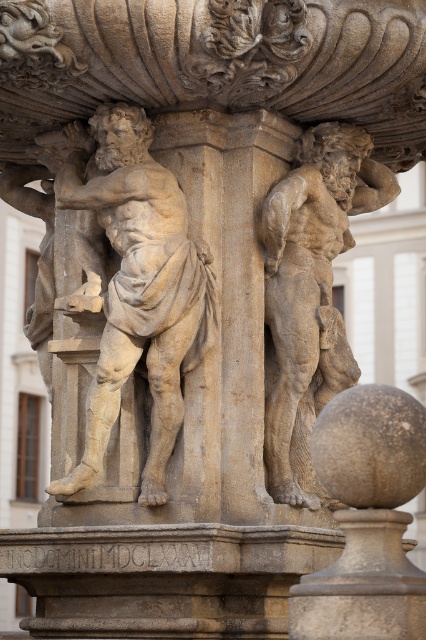
Question: Which point appears closest to the camera in this image?

Choices:
 (A) (100, 294)
 (B) (279, 272)

Answer: (A)

Question: Does beige stone statue at center appear on the right side of stone textured figure at center?

Choices:
 (A) yes
 (B) no

Answer: (B)

Question: Which point is farther to the camera?

Choices:
 (A) (299, 392)
 (B) (166, 493)

Answer: (A)

Question: Does beige stone statue at center appear on the right side of stone textured figure at center?

Choices:
 (A) yes
 (B) no

Answer: (B)

Question: Considering the relative positions of beige stone statue at center and stone textured figure at center in the image provided, where is beige stone statue at center located with respect to stone textured figure at center?

Choices:
 (A) above
 (B) below

Answer: (A)

Question: Which point is closer to the camera taking this photo?

Choices:
 (A) (100, 346)
 (B) (310, 348)

Answer: (A)